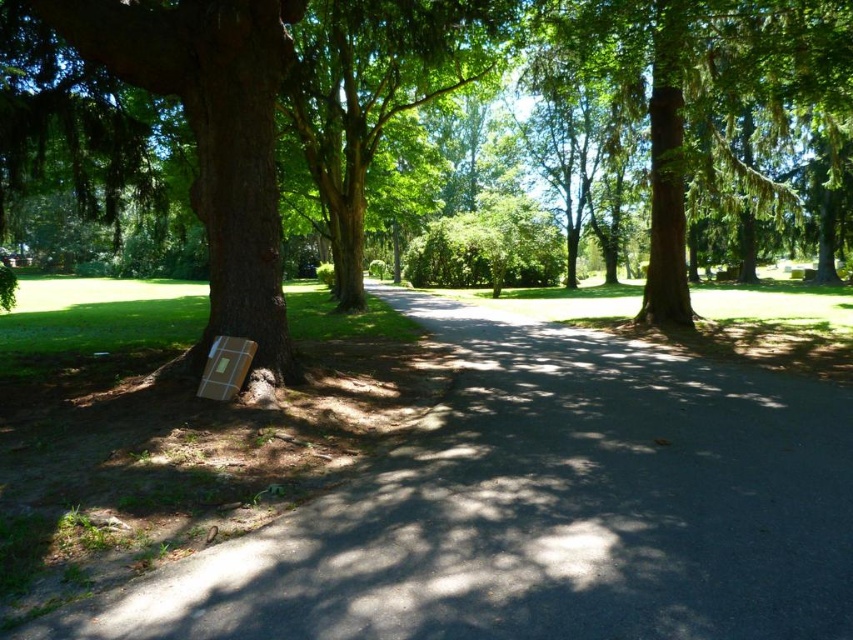
Is brown cardboard box at lower left further to camera compared to green textured tree at center?

No, brown cardboard box at lower left is in front of green textured tree at center.

Can you confirm if brown cardboard box at lower left is smaller than green textured tree at center?

Indeed, brown cardboard box at lower left has a smaller size compared to green textured tree at center.

In order to click on brown cardboard box at lower left in this screenshot , I will do `click(210, 138)`.

Does point (3, 48) come in front of point (833, 74)?

Yes, point (3, 48) is in front of point (833, 74).

Which is more to the left, brown textured trunk at left or green textured tree at center?

brown textured trunk at left

Who is more distant from viewer, (x=793, y=54) or (x=642, y=22)?

Point (x=642, y=22)

Find the location of a particular element. The height and width of the screenshot is (640, 853). brown textured trunk at left is located at coordinates (202, 122).

Between point (602, 340) and point (833, 67), which one is positioned in front?

Point (833, 67) is more forward.

Does brown cardboard box at left have a greater width compared to green textured tree at center?

No.

Does point (479, 522) lie behind point (671, 122)?

No, it is in front of (671, 122).

Identify the location of brown cardboard box at left. The height and width of the screenshot is (640, 853). (544, 509).